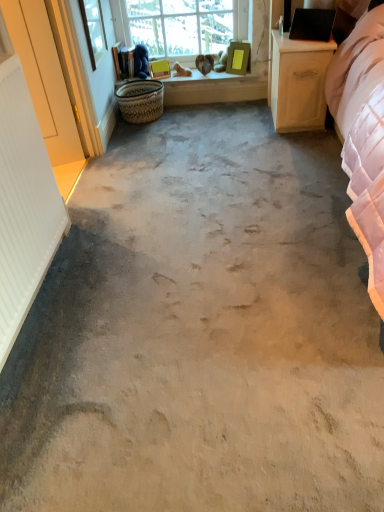
Question: Could you tell me if woven natural basket at center is turned towards clear glass window at upper center?

Choices:
 (A) yes
 (B) no

Answer: (B)

Question: Is woven natural basket at center far from clear glass window at upper center?

Choices:
 (A) no
 (B) yes

Answer: (A)

Question: Is woven natural basket at center turned away from clear glass window at upper center?

Choices:
 (A) yes
 (B) no

Answer: (B)

Question: Is woven natural basket at center at the right side of clear glass window at upper center?

Choices:
 (A) no
 (B) yes

Answer: (A)

Question: From the image's perspective, would you say woven natural basket at center is shown under clear glass window at upper center?

Choices:
 (A) no
 (B) yes

Answer: (B)

Question: Is woven natural basket at center closer to camera compared to clear glass window at upper center?

Choices:
 (A) no
 (B) yes

Answer: (B)

Question: Considering the relative positions of clear glass window at upper center and clear glass window screen at upper left in the image provided, is clear glass window at upper center to the left of clear glass window screen at upper left from the viewer's perspective?

Choices:
 (A) yes
 (B) no

Answer: (B)

Question: Is clear glass window screen at upper left at the back of clear glass window at upper center?

Choices:
 (A) yes
 (B) no

Answer: (B)

Question: Is clear glass window at upper center not within clear glass window screen at upper left?

Choices:
 (A) yes
 (B) no

Answer: (A)

Question: Can you confirm if clear glass window at upper center is taller than clear glass window screen at upper left?

Choices:
 (A) no
 (B) yes

Answer: (B)

Question: From a real-world perspective, is clear glass window at upper center located beneath clear glass window screen at upper left?

Choices:
 (A) yes
 (B) no

Answer: (A)

Question: Considering the relative sizes of clear glass window at upper center and clear glass window screen at upper left in the image provided, is clear glass window at upper center shorter than clear glass window screen at upper left?

Choices:
 (A) no
 (B) yes

Answer: (A)

Question: Is light wood/wooden nightstand at right oriented away from wooden window sill at upper center?

Choices:
 (A) no
 (B) yes

Answer: (A)